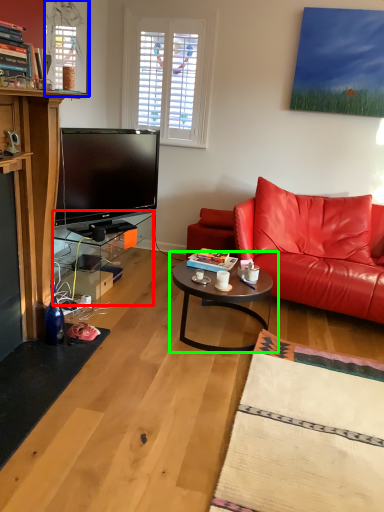
Question: Which is nearer to the table (highlighted by a red box)? window screen (highlighted by a blue box) or coffee table (highlighted by a green box).

Choices:
 (A) window screen
 (B) coffee table

Answer: (B)